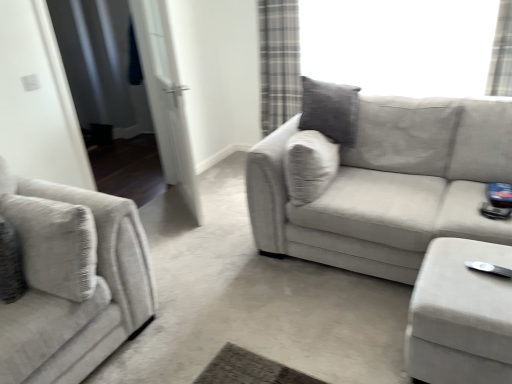
Question: In terms of width, does white fabric screen door at left, positioned as the first screen door in left-to-right order, look wider or thinner when compared to textured beige couch at center, marked as the first studio couch in a right-to-left arrangement?

Choices:
 (A) thin
 (B) wide

Answer: (A)

Question: Relative to textured beige couch at center, marked as the first studio couch in a right-to-left arrangement, is white fabric screen door at left, positioned as the first screen door in left-to-right order, in front or behind?

Choices:
 (A) behind
 (B) front

Answer: (A)

Question: Which is farther from the velvet beige ottoman at lower right?

Choices:
 (A) textured gray couch at left, the 1th studio couch from the left
 (B) white glossy door at left, which is the 2th screen door from left to right
 (C) white fabric screen door at left, which is the 2th screen door in right-to-left order
 (D) white plastic wii controller at lower right
 (E) plaid fabric curtain at upper right

Answer: (C)

Question: Which of these objects is positioned farthest from the white fabric screen door at left, which is the 2th screen door in right-to-left order?

Choices:
 (A) plaid fabric curtain at upper right
 (B) textured gray couch at left, placed as the 2th studio couch when sorted from right to left
 (C) white glossy door at left, marked as the 1th screen door in a right-to-left arrangement
 (D) velvet beige ottoman at lower right
 (E) textured beige couch at center, which ranks as the second studio couch in left-to-right order

Answer: (D)